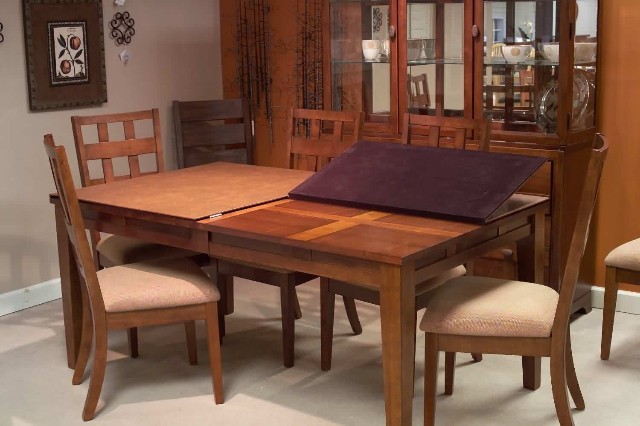
Find the location of a particular element. flooring is located at coordinates (324, 395), (605, 372), (29, 346).